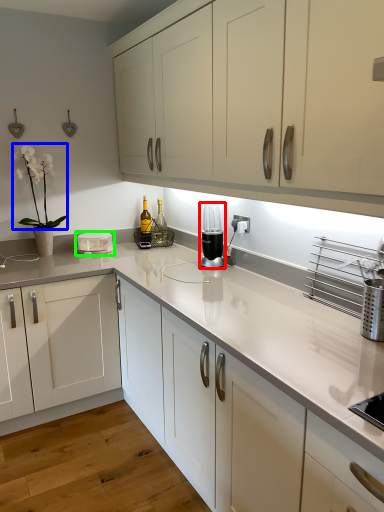
Question: Based on their relative distances, which object is farther from home appliance (highlighted by a red box)? Choose from plant (highlighted by a blue box) and appliance (highlighted by a green box).

Choices:
 (A) plant
 (B) appliance

Answer: (A)